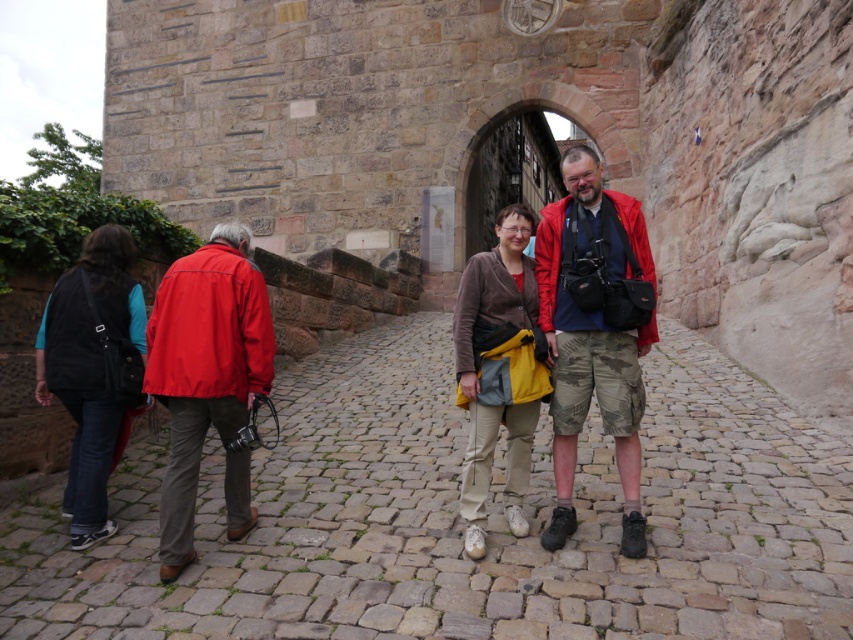
Question: Does matte red jacket at left have a smaller size compared to black fabric backpack at left?

Choices:
 (A) yes
 (B) no

Answer: (B)

Question: From the image, what is the correct spatial relationship of camouflage shorts at center in relation to matte red jacket at left?

Choices:
 (A) above
 (B) below

Answer: (A)

Question: Estimate the real-world distances between objects in this image. Which object is closer to the black fabric backpack at left?

Choices:
 (A) camouflage shorts at center
 (B) matte red jacket at left

Answer: (B)

Question: Is brown textured jacket at center closer to the viewer compared to black fabric backpack at left?

Choices:
 (A) no
 (B) yes

Answer: (B)

Question: Which of the following is the closest to the observer?

Choices:
 (A) brown textured jacket at center
 (B) black fabric backpack at left
 (C) camouflage shorts at center
 (D) matte red jacket at left

Answer: (D)

Question: Which object is the closest to the matte red jacket at left?

Choices:
 (A) camouflage shorts at center
 (B) brown textured jacket at center

Answer: (B)